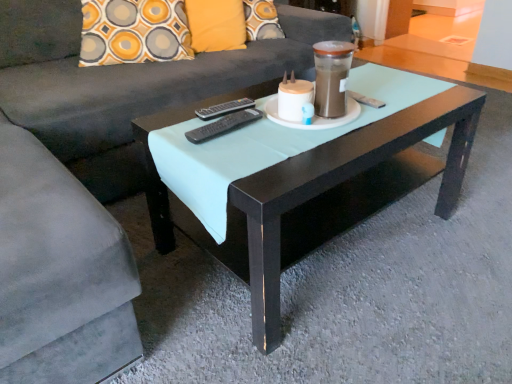
Question: In terms of width, does black matte coffee table at center look wider or thinner when compared to black plastic remote at center, which is counted as the second remote, starting from the back?

Choices:
 (A) thin
 (B) wide

Answer: (B)

Question: From a real-world perspective, is black matte coffee table at center above or below black plastic remote at center, which is counted as the second remote, starting from the back?

Choices:
 (A) below
 (B) above

Answer: (A)

Question: Which of these objects is positioned closest to the black plastic remote at center, the 1th remote in the back-to-front sequence?

Choices:
 (A) black plastic remote at center, which is counted as the second remote, starting from the back
 (B) suede gray couch at center
 (C) black matte coffee table at center
 (D) transparent glass beverage at center

Answer: (A)

Question: Considering the real-world distances, which object is closest to the suede gray couch at center?

Choices:
 (A) black plastic remote at center, the first remote in the front-to-back sequence
 (B) transparent glass beverage at center
 (C) black plastic remote at center, the 1th remote in the back-to-front sequence
 (D) black matte coffee table at center

Answer: (D)